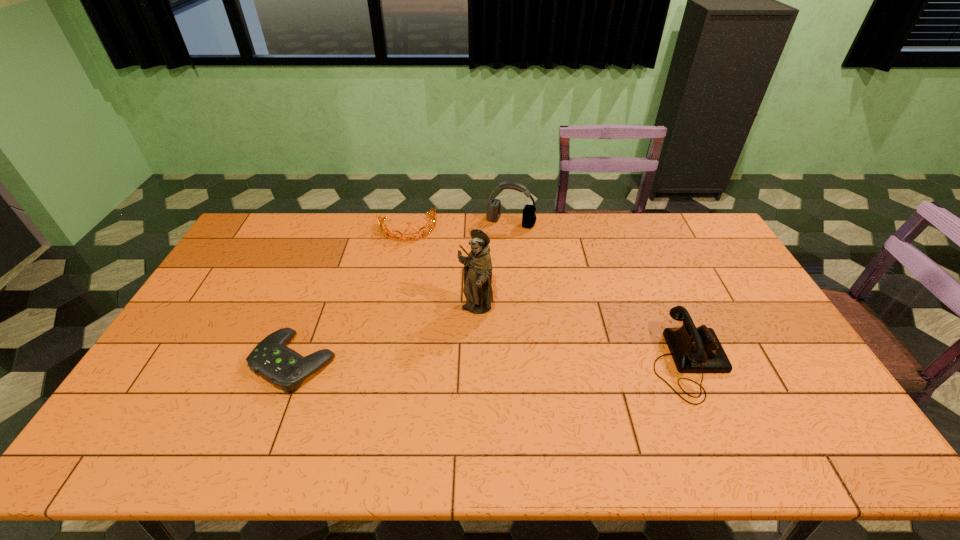
Identify the location of the leftmost object. (280, 365).

Find the location of a particular element. control is located at coordinates (280, 365).

In order to click on the third shortest object in this screenshot , I will do `click(694, 350)`.

You are a GUI agent. You are given a task and a screenshot of the screen. Output one action in this format:
    pyautogui.click(x=<x>, y=<y>)
    Task: Click on the telephone
    The width and height of the screenshot is (960, 540).
    Given the screenshot: What is the action you would take?
    tap(694, 350)

Where is `headset`? headset is located at coordinates (494, 205).

Locate an element on the screen. tiara is located at coordinates (432, 227).

Identify the location of the second shortest object. (432, 227).

I want to click on figurine, so click(477, 289).

Locate an element on the screen. This screenshot has width=960, height=540. the third nearest object is located at coordinates (477, 289).

Find the location of a particular element. This screenshot has height=540, width=960. free spot located 0.230m on the left of the leftmost object is located at coordinates (170, 362).